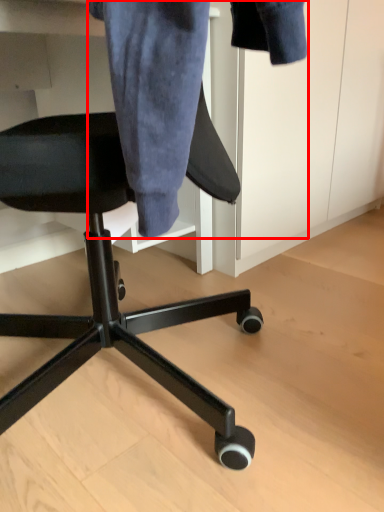
Question: In this image, where is denim jacket (annotated by the red box) located relative to chair?

Choices:
 (A) left
 (B) right

Answer: (B)